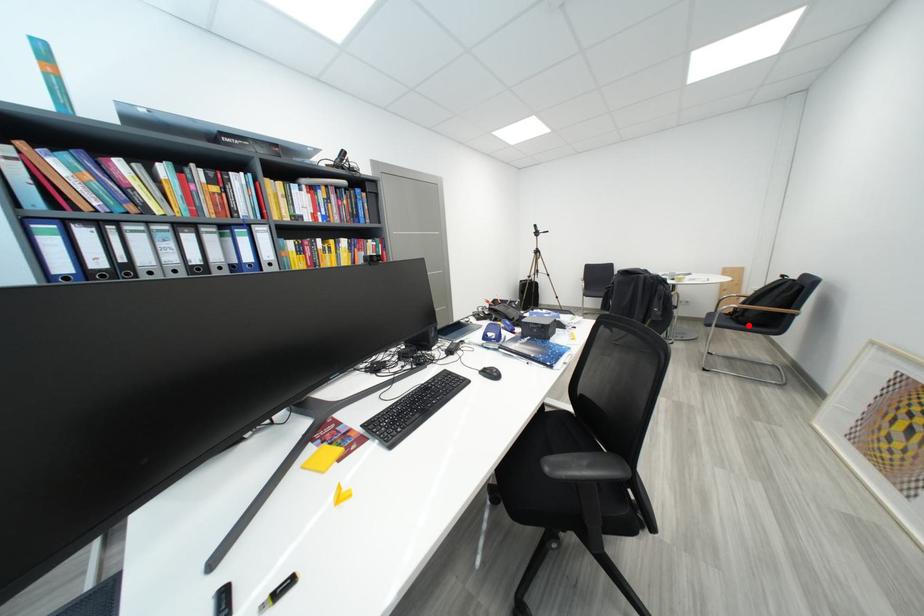
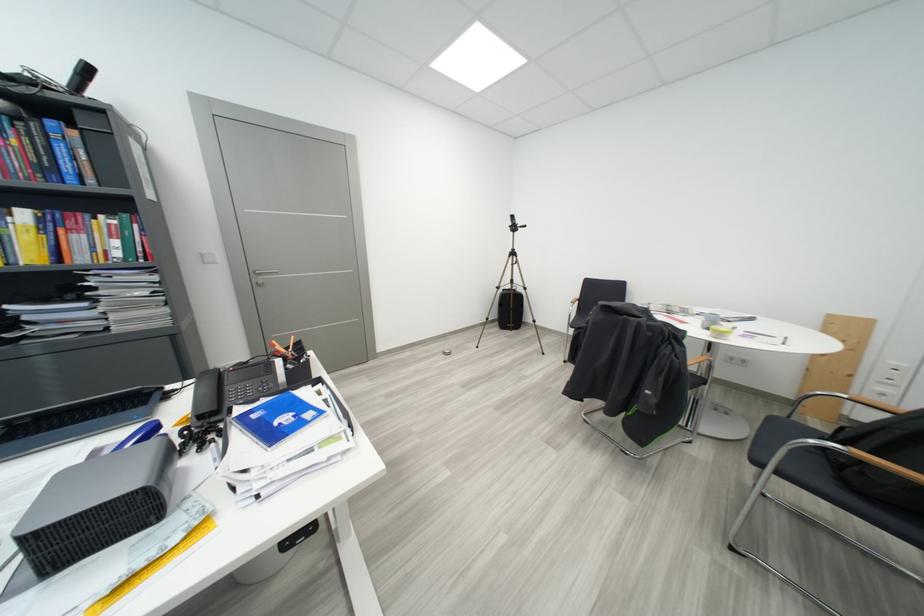
The point at the highlighted location is marked in the first image. Where is the corresponding point in the second image?

(856, 487)